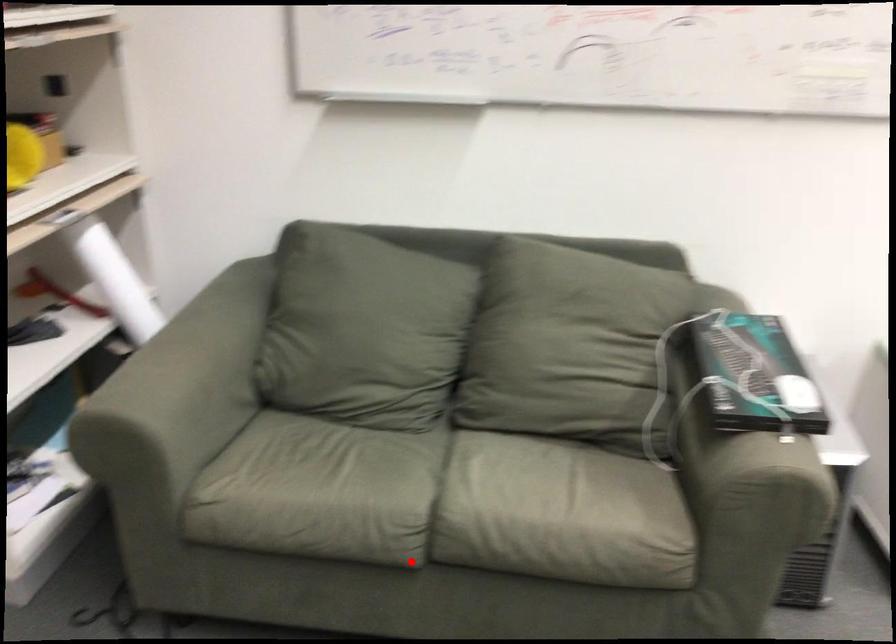
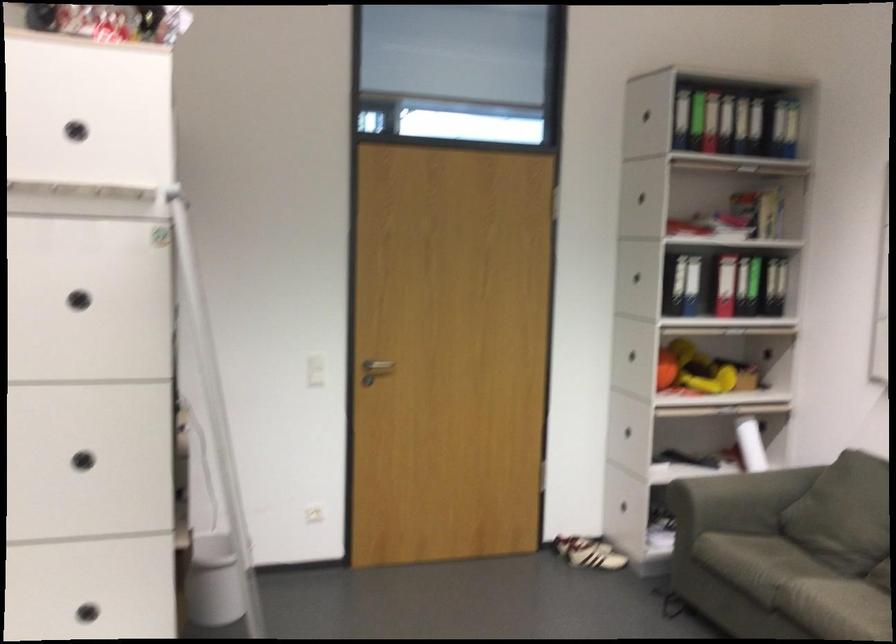
Where in the second image is the point corresponding to the highlighted location from the first image?

(771, 623)